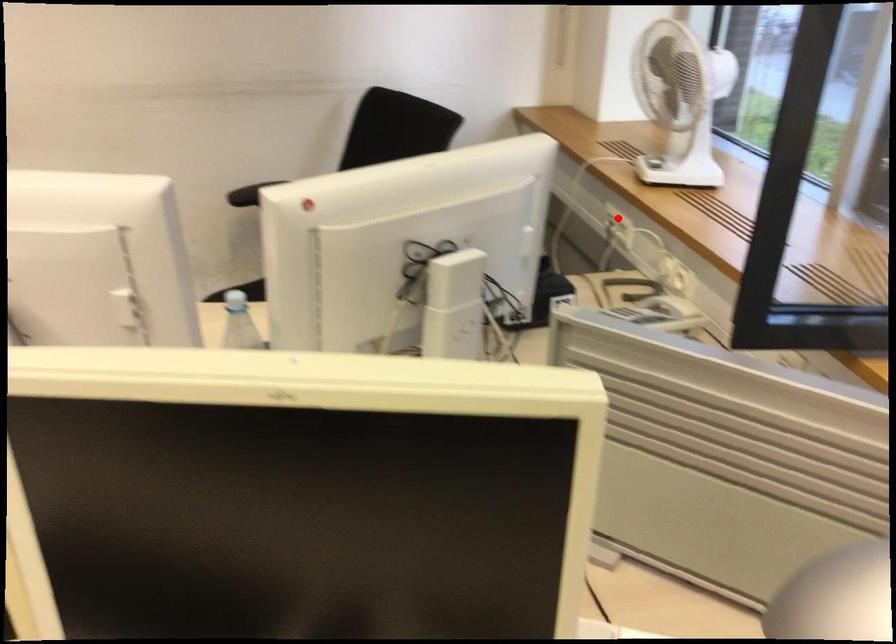
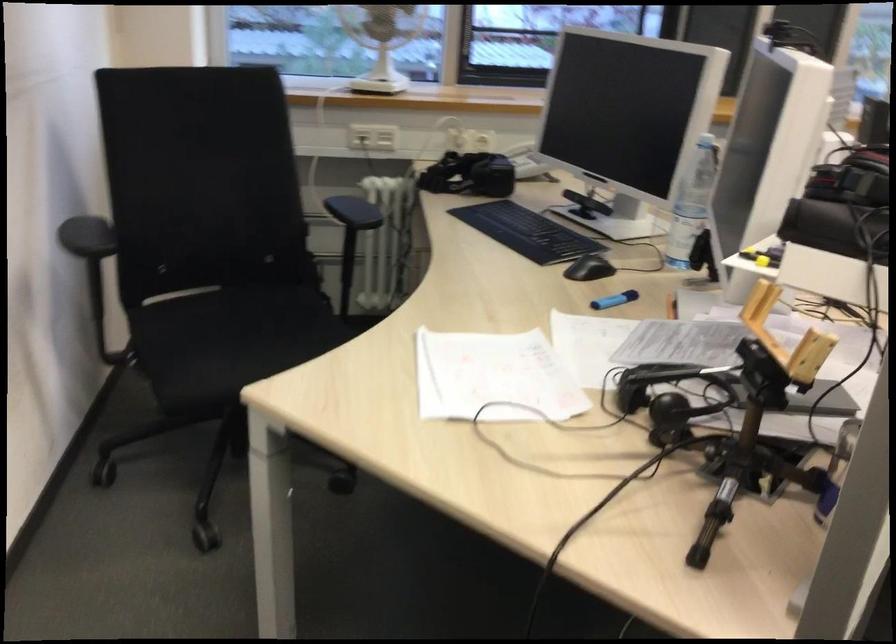
Question: I am providing you with two images of the same scene from different viewpoints. Image1 has a red point marked. In image2, the corresponding 3D location appears at what relative position? Reply with the corresponding letter.

Choices:
 (A) Closer
 (B) Farther

Answer: (B)